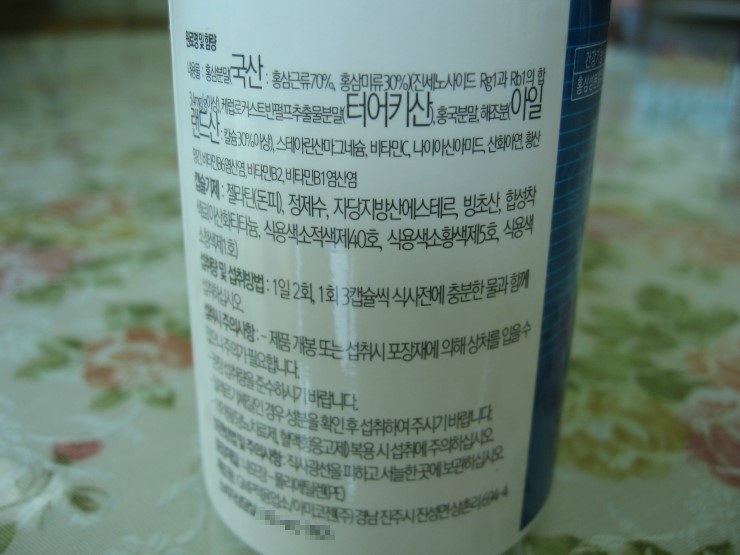
Image resolution: width=740 pixels, height=555 pixels. What are the coordinates of `floral pattern on countertop` in the screenshot? It's located at (126, 356), (635, 367), (74, 444), (97, 206).